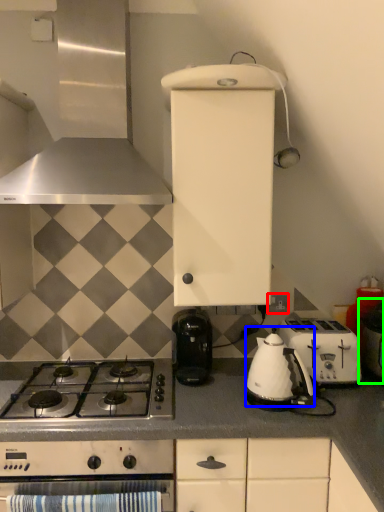
Question: Which object is the farthest from electric outlet (highlighted by a red box)? Choose among these: tea pot (highlighted by a blue box) or appliance (highlighted by a green box).

Choices:
 (A) tea pot
 (B) appliance

Answer: (A)